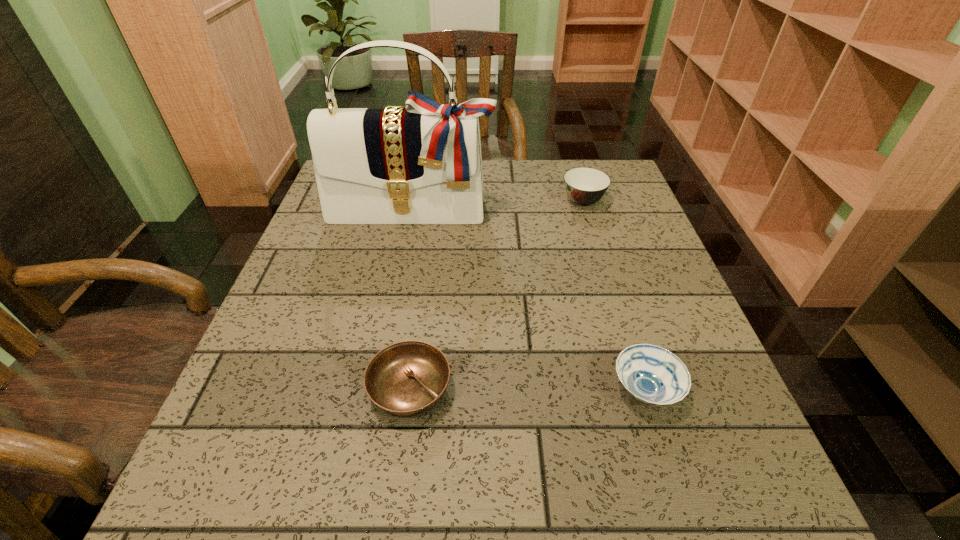
Locate an element on the screen. This screenshot has width=960, height=540. soup bowl object that ranks as the second closest to the leftmost soup bowl is located at coordinates (584, 186).

This screenshot has width=960, height=540. Identify the location of soup bowl that can be found as the second closest to the tallest soup bowl. (406, 379).

I want to click on free space that satisfies the following two spatial constraints: 1. on the front-facing side of the leftmost soup bowl; 2. on the right side of the tallest object, so click(x=377, y=390).

Locate an element on the screen. free point that satisfies the following two spatial constraints: 1. on the front-facing side of the tallest object; 2. on the left side of the leftmost soup bowl is located at coordinates (377, 390).